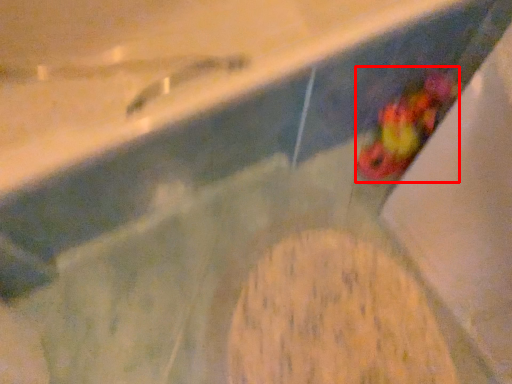
Question: Considering the relative positions of food (annotated by the red box) and food in the image provided, where is food (annotated by the red box) located with respect to the staircase?

Choices:
 (A) right
 (B) left

Answer: (A)